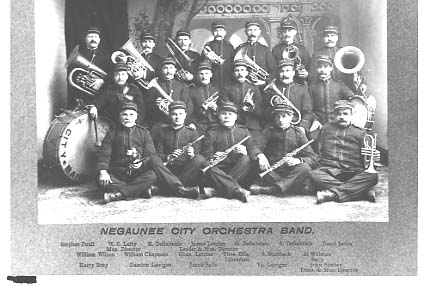
What are the coordinates of `wall` in the screenshot? It's located at (370, 27), (44, 46).